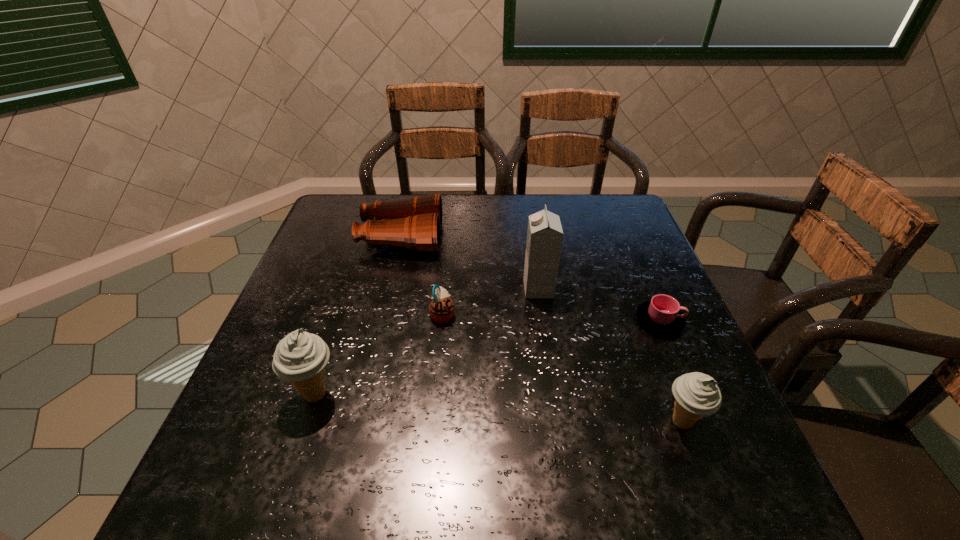
At what (x,y) coordinates should I click in order to perform the action: click on the second tallest object. Please return your answer as a coordinate pair (x, y). Looking at the image, I should click on (300, 358).

Identify the location of the taller icecream. This screenshot has width=960, height=540. (300, 358).

Locate an element on the screen. the shorter icecream is located at coordinates (696, 394).

Locate an element on the screen. Image resolution: width=960 pixels, height=540 pixels. the fourth shortest object is located at coordinates (696, 394).

Locate an element on the screen. The height and width of the screenshot is (540, 960). the shortest object is located at coordinates (662, 315).

The width and height of the screenshot is (960, 540). Find the location of `the tallest object`. the tallest object is located at coordinates (544, 234).

Find the location of `the fifth nearest object`. the fifth nearest object is located at coordinates (544, 234).

Where is `binoculars`? The height and width of the screenshot is (540, 960). binoculars is located at coordinates (415, 223).

In order to click on the farthest object in this screenshot , I will do `click(415, 223)`.

Where is `muffin`? Image resolution: width=960 pixels, height=540 pixels. muffin is located at coordinates (441, 308).